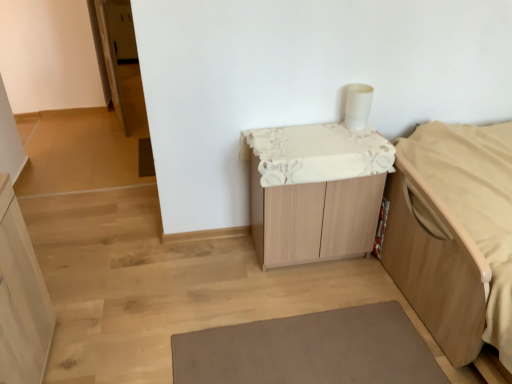
In order to click on blank space to the left of wooden cabinet at center in this screenshot , I will do `click(222, 275)`.